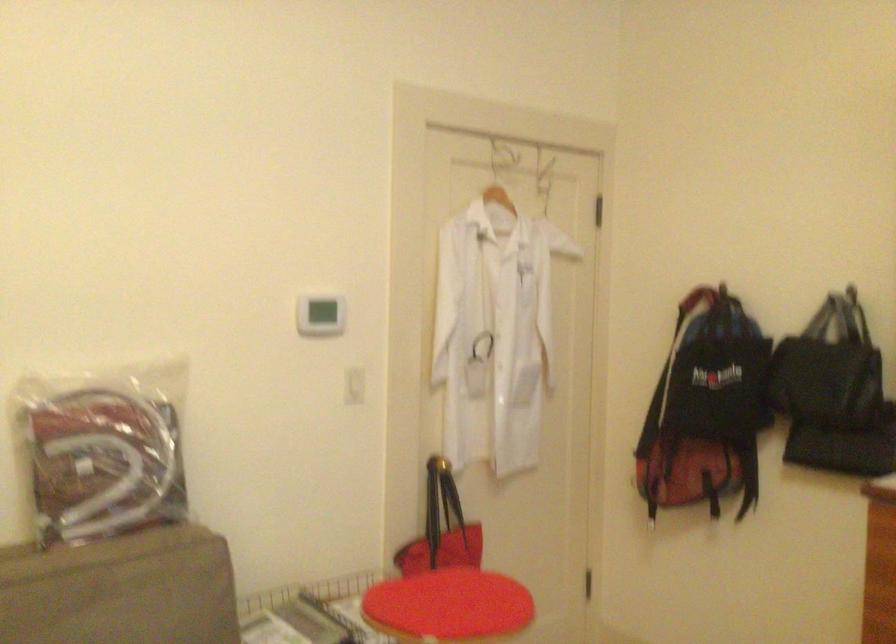
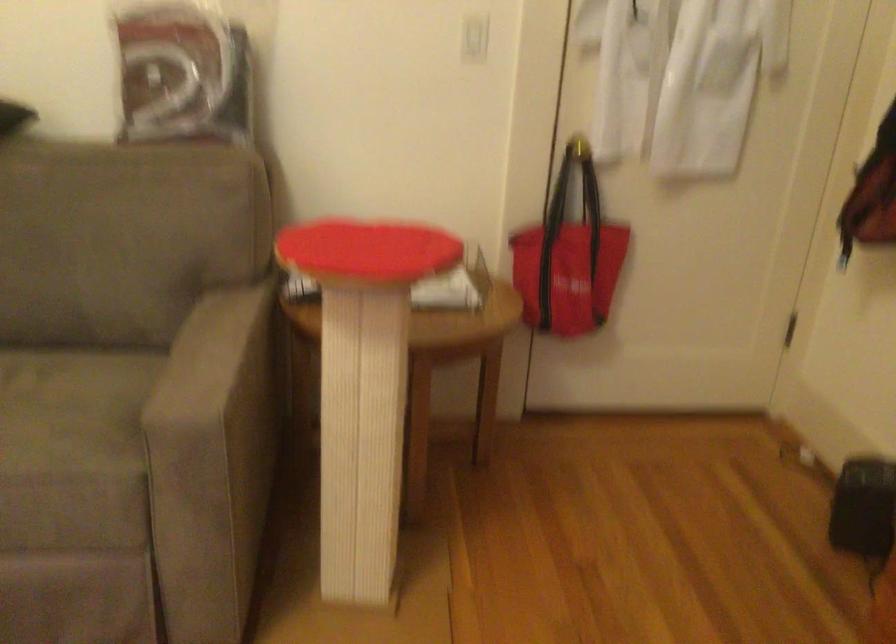
Locate, in the second image, the point that corresponds to [352,391] in the first image.

(474, 38)